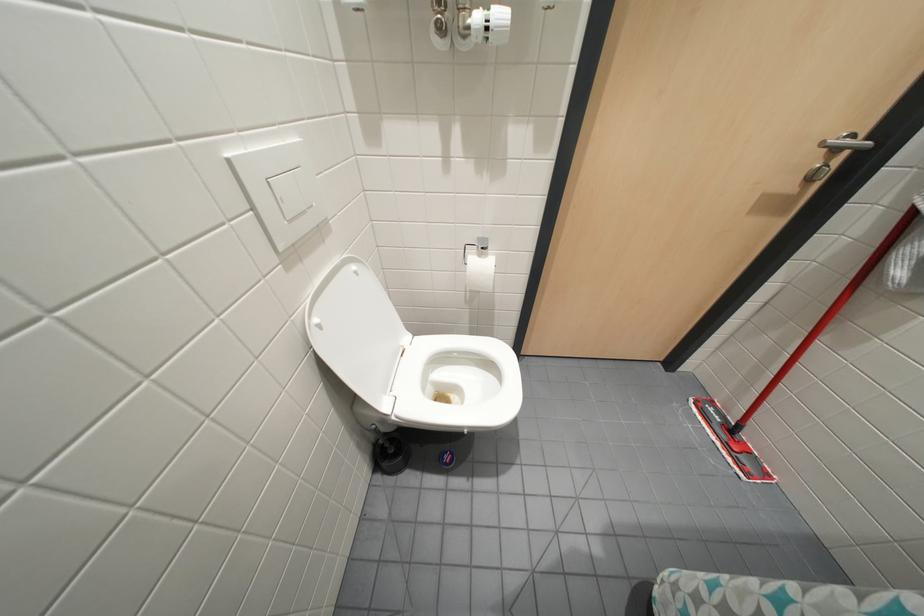
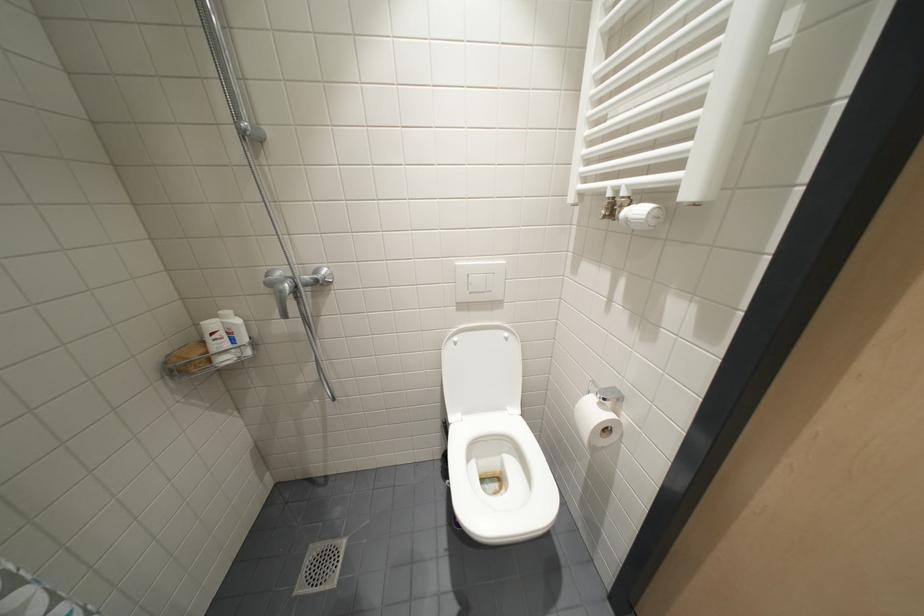
Question: The camera is either moving clockwise (left) or counter-clockwise (right) around the object. The first image is from the beginning of the video and the second image is from the end. Is the camera moving left or right when shooting the video?

Choices:
 (A) Left
 (B) Right

Answer: (B)